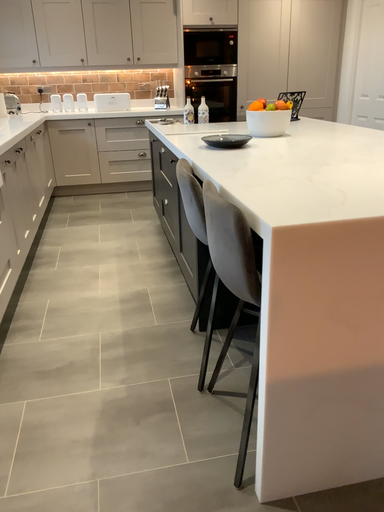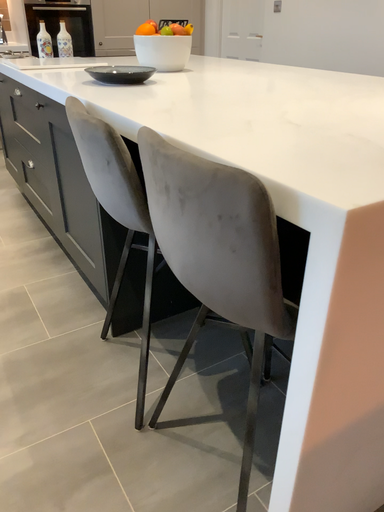
Question: How did the camera likely rotate when shooting the video?

Choices:
 (A) rotated right
 (B) rotated left

Answer: (A)